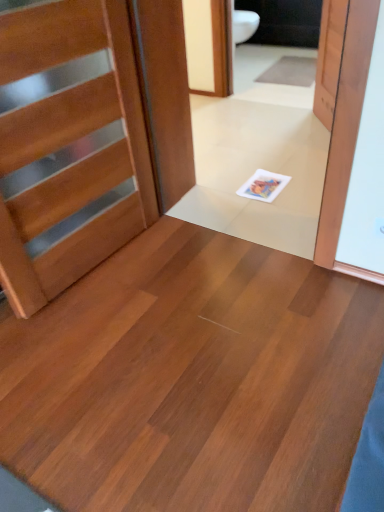
Identify the location of vacant space underneath wooden door at left, marked as the second door in a back-to-front arrangement (from a real-world perspective). (98, 268).